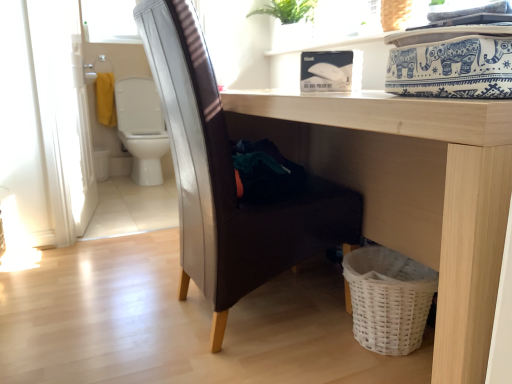
This screenshot has width=512, height=384. What do you see at coordinates (142, 128) in the screenshot?
I see `white glossy toilet at left` at bounding box center [142, 128].

Describe the element at coordinates (109, 21) in the screenshot. I see `transparent glass window screen at upper left` at that location.

The height and width of the screenshot is (384, 512). What do you see at coordinates (228, 178) in the screenshot? I see `leather-like brown chair at center` at bounding box center [228, 178].

Locate an element on the screen. Image resolution: width=512 pixels, height=384 pixels. white glossy screen door at left is located at coordinates (63, 114).

In the scene shown: Considering the sizes of objects white glossy screen door at left and leather-like brown chair at center in the image provided, who is taller, white glossy screen door at left or leather-like brown chair at center?

white glossy screen door at left.

Which of these two, white glossy screen door at left or leather-like brown chair at center, is bigger?

leather-like brown chair at center.

Would you consider white glossy screen door at left to be distant from leather-like brown chair at center?

white glossy screen door at left is positioned a significant distance from leather-like brown chair at center.

Between light wood table at lower center and white glossy toilet at left, which one appears on the left side from the viewer's perspective?

white glossy toilet at left.

At what (x,y) coordinates should I click in order to perform the action: click on swivel chair behind the light wood table at lower center. Please return your answer as a coordinate pair (x, y). This screenshot has width=512, height=384. Looking at the image, I should click on (142, 128).

Between light wood table at lower center and white glossy toilet at left, which one has more height?

white glossy toilet at left.

Is light wood table at lower center looking in the opposite direction of white glossy toilet at left?

No, light wood table at lower center's orientation is not away from white glossy toilet at left.

Does point (359, 200) lie in front of point (421, 150)?

That is False.

Identify the location of table beneath the leather-like brown chair at center (from a real-world perspective). The height and width of the screenshot is (384, 512). (411, 190).

Consider the image. Which is more to the right, leather-like brown chair at center or light wood table at lower center?

light wood table at lower center.

Is leather-like brown chair at center further to camera compared to light wood table at lower center?

That is True.

Between leather-like brown chair at center and transparent glass window screen at upper left, which one appears on the right side from the viewer's perspective?

Positioned to the right is leather-like brown chair at center.

Who is bigger, leather-like brown chair at center or transparent glass window screen at upper left?

leather-like brown chair at center is bigger.

Is point (234, 202) positioned in front of point (95, 15)?

Yes, point (234, 202) is closer to viewer.

From a real-world perspective, is leather-like brown chair at center physically below transparent glass window screen at upper left?

Yes.

In the image, there is a white glossy toilet at left. Identify the location of screen door below it (from the image's perspective). The image size is (512, 384). 63,114.

Looking at their sizes, would you say white glossy toilet at left is wider or thinner than white glossy screen door at left?

Clearly, white glossy toilet at left has more width compared to white glossy screen door at left.

Is white glossy toilet at left bigger or smaller than white glossy screen door at left?

In the image, white glossy toilet at left appears to be larger than white glossy screen door at left.

Which object is closer to the camera taking this photo, white glossy toilet at left or light wood table at lower center?

light wood table at lower center is more forward.

Is point (122, 113) positioned in front of point (426, 219)?

No.

Where is `table located below the white glossy toilet at left (from the image's perspective)`? The image size is (512, 384). table located below the white glossy toilet at left (from the image's perspective) is located at coordinates (411, 190).

Does point (146, 9) come behind point (140, 97)?

No.

Can you confirm if leather-like brown chair at center is bigger than white glossy toilet at left?

Indeed, leather-like brown chair at center has a larger size compared to white glossy toilet at left.

Measure the distance from leather-like brown chair at center to white glossy toilet at left.

2.07 meters.

From the image's perspective, which object appears higher, leather-like brown chair at center or white glossy toilet at left?

From the image's view, white glossy toilet at left is above.

The width and height of the screenshot is (512, 384). There is a leather-like brown chair at center. Identify the location of screen door above it (from a real-world perspective). (63, 114).

I want to click on table on the right of white glossy toilet at left, so click(411, 190).

From the image, which object appears to be farther from leather-like brown chair at center, white glossy toilet at left or transparent glass window screen at upper left?

Among the two, transparent glass window screen at upper left is located further to leather-like brown chair at center.

Estimate the real-world distances between objects in this image. Which object is further from white glossy screen door at left, white glossy toilet at left or transparent glass window screen at upper left?

transparent glass window screen at upper left is positioned further to the anchor white glossy screen door at left.

Looking at the image, which one is located closer to leather-like brown chair at center, white glossy screen door at left or white glossy toilet at left?

white glossy screen door at left is positioned closer to the anchor leather-like brown chair at center.

Looking at the image, which one is located closer to light wood table at lower center, white glossy screen door at left or white glossy toilet at left?

white glossy screen door at left is positioned closer to the anchor light wood table at lower center.

Looking at the image, which one is located closer to transparent glass window screen at upper left, white glossy screen door at left or leather-like brown chair at center?

Among the two, white glossy screen door at left is located nearer to transparent glass window screen at upper left.

Which object lies nearer to the anchor point light wood table at lower center, white glossy screen door at left or leather-like brown chair at center?

The object closer to light wood table at lower center is leather-like brown chair at center.

Based on their spatial positions, is leather-like brown chair at center or white glossy toilet at left further from transparent glass window screen at upper left?

leather-like brown chair at center is positioned further to the anchor transparent glass window screen at upper left.

Which object lies nearer to the anchor point white glossy screen door at left, white glossy toilet at left or light wood table at lower center?

Based on the image, white glossy toilet at left appears to be nearer to white glossy screen door at left.

Where is `swivel chair located between light wood table at lower center and transparent glass window screen at upper left in the depth direction`? swivel chair located between light wood table at lower center and transparent glass window screen at upper left in the depth direction is located at coordinates (142, 128).

Image resolution: width=512 pixels, height=384 pixels. I want to click on screen door positioned between leather-like brown chair at center and transparent glass window screen at upper left from near to far, so 63,114.

Where is `chair between light wood table at lower center and white glossy screen door at left from front to back`? chair between light wood table at lower center and white glossy screen door at left from front to back is located at coordinates (228, 178).

This screenshot has height=384, width=512. I want to click on screen door positioned between leather-like brown chair at center and white glossy toilet at left from near to far, so click(x=63, y=114).